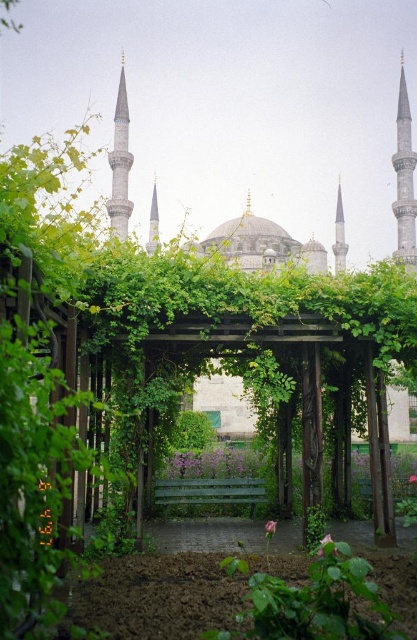
You are a gardener who wants to place a small statue between the pink petal at center and the pink fabric flower at center. Which one should you place the statue closer to in order to avoid blocking the view of the taller object?

The pink petal at center is taller than the pink fabric flower at center, so you should place the statue closer to the pink fabric flower at center to avoid blocking the view of the taller pink petal at center.

You are a gardener trying to distinguish between the pink petal at center and the pink fabric flower at center in the garden scene. Which one is narrower in width?

The pink petal at center has a lesser width compared to the pink fabric flower at center, so the pink petal at center is narrower.

You are a tourist standing in the garden looking at the Blue Mosque in the background. You notice a pink matte rose at center and a pink petal at center. Which object is closer to you?

The pink matte rose at center is closer to you because it is in front of the pink petal at center.